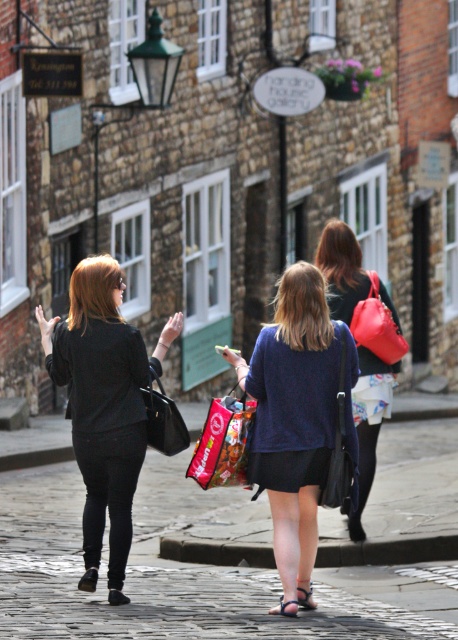
From the picture: Between cobblestone pavement at center and blue cotton dress at center, which one appears on the left side from the viewer's perspective?

From the viewer's perspective, cobblestone pavement at center appears more on the left side.

Which is above, cobblestone pavement at center or blue cotton dress at center?

Positioned higher is blue cotton dress at center.

This screenshot has height=640, width=458. I want to click on cobblestone pavement at center, so click(190, 570).

Does point (301, 541) come behind point (198, 451)?

No.

Is point (312, 324) positioned in front of point (212, 438)?

Yes, it is.

Identify the location of blue cotton dress at center. The width and height of the screenshot is (458, 640). (296, 419).

Locate an element on the screen. This screenshot has height=640, width=458. blue cotton dress at center is located at coordinates (296, 419).

Based on the photo, is matte black jacket at center bigger than matte black handbag at center?

Actually, matte black jacket at center might be smaller than matte black handbag at center.

This screenshot has width=458, height=640. What are the coordinates of `matte black jacket at center` in the screenshot? It's located at (369, 426).